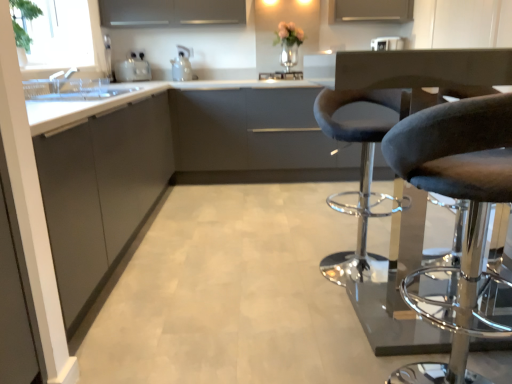
Measure the distance between point [91,285] and camera.

Point [91,285] is 6.15 feet from camera.

The height and width of the screenshot is (384, 512). I want to click on dark gray fabric stool at right, so click(x=391, y=230).

Measure the distance between satin silver toaster at left, placed as the third appliance when sorted from right to left, and camera.

They are 3.76 meters apart.

Where is `satin silver sink at center, the 2th appliance viewed from the left`? satin silver sink at center, the 2th appliance viewed from the left is located at coordinates (281, 75).

Is gray fabric swivel chair at right situated inside satin silver toaster at left, placed as the third appliance when sorted from right to left, or outside?

gray fabric swivel chair at right is located beyond the bounds of satin silver toaster at left, placed as the third appliance when sorted from right to left.

In the scene shown: Can you tell me how much gray fabric swivel chair at right and satin silver toaster at left, placed as the third appliance when sorted from right to left, differ in facing direction?

gray fabric swivel chair at right and satin silver toaster at left, placed as the third appliance when sorted from right to left, are facing 46.4 degrees away from each other.

From the image's perspective, is gray fabric swivel chair at right beneath satin silver toaster at left, placed as the third appliance when sorted from right to left?

Indeed, from the image's perspective, gray fabric swivel chair at right is shown beneath satin silver toaster at left, placed as the third appliance when sorted from right to left.

Which is more to the right, gray fabric swivel chair at right or satin silver toaster at left, placed as the third appliance when sorted from right to left?

gray fabric swivel chair at right is more to the right.

Could you tell me if matte gray cabinet at upper center, marked as the 3th cabinetry in a front-to-back arrangement, is facing matte gray cabinet at center, arranged as the 2th cabinetry when viewed from the front?

No, matte gray cabinet at upper center, marked as the 3th cabinetry in a front-to-back arrangement, is not turned towards matte gray cabinet at center, arranged as the 2th cabinetry when viewed from the front.

From a real-world perspective, is matte gray cabinet at upper center, marked as the 3th cabinetry in a front-to-back arrangement, positioned above or below matte gray cabinet at center, arranged as the 2th cabinetry when viewed from the front?

matte gray cabinet at upper center, marked as the 3th cabinetry in a front-to-back arrangement, is above matte gray cabinet at center, arranged as the 2th cabinetry when viewed from the front.

Can you confirm if matte gray cabinet at upper center, the first cabinetry positioned from the back, is thinner than matte gray cabinet at center, arranged as the 2th cabinetry when viewed from the front?

Correct, the width of matte gray cabinet at upper center, the first cabinetry positioned from the back, is less than that of matte gray cabinet at center, arranged as the 2th cabinetry when viewed from the front.

Can you confirm if matte gray cabinet at upper center, marked as the 3th cabinetry in a front-to-back arrangement, is taller than matte gray cabinet at center, arranged as the 2th cabinetry when viewed from the front?

No, matte gray cabinet at upper center, marked as the 3th cabinetry in a front-to-back arrangement, is not taller than matte gray cabinet at center, arranged as the 2th cabinetry when viewed from the front.

Considering the sizes of objects dark gray fabric stool at right and gray fabric swivel chair at right in the image provided, who is smaller, dark gray fabric stool at right or gray fabric swivel chair at right?

Smaller between the two is gray fabric swivel chair at right.

Are dark gray fabric stool at right and gray fabric swivel chair at right far apart?

They are positioned close to each other.

Considering the positions of objects dark gray fabric stool at right and gray fabric swivel chair at right in the image provided, who is behind, dark gray fabric stool at right or gray fabric swivel chair at right?

gray fabric swivel chair at right is more distant.

From a real-world perspective, is dark gray fabric stool at right located higher than gray fabric swivel chair at right?

Yes, from a real-world perspective, dark gray fabric stool at right is over gray fabric swivel chair at right

Could you tell me if dark gray fabric stool at right is turned towards matte gray cabinet at left, acting as the 3th cabinetry starting from the back?

No, dark gray fabric stool at right is not facing towards matte gray cabinet at left, acting as the 3th cabinetry starting from the back.

Between dark gray fabric stool at right and matte gray cabinet at left, which is the first cabinetry from front to back, which one has smaller width?

dark gray fabric stool at right is thinner.

Would you say dark gray fabric stool at right is to the left or to the right of matte gray cabinet at left, which is the first cabinetry from front to back, in the picture?

dark gray fabric stool at right is positioned on matte gray cabinet at left, which is the first cabinetry from front to back,'s right side.

From the image's perspective, is dark gray fabric stool at right below matte gray cabinet at left, which is the first cabinetry from front to back?

Yes, from the image's perspective, dark gray fabric stool at right is below matte gray cabinet at left, which is the first cabinetry from front to back.

Can you confirm if matte gray cabinet at center, arranged as the 2th cabinetry when viewed from the front, is positioned to the left of dark gray fabric stool at right?

Yes, matte gray cabinet at center, arranged as the 2th cabinetry when viewed from the front, is to the left of dark gray fabric stool at right.

Between point (233, 145) and point (414, 315), which one is positioned in front?

Point (414, 315)

Is white glossy toaster at upper center, marked as the third appliance in a left-to-right arrangement, inside or outside of matte gray cabinet at center, the 2th cabinetry positioned from the back?

white glossy toaster at upper center, marked as the third appliance in a left-to-right arrangement, is not enclosed by matte gray cabinet at center, the 2th cabinetry positioned from the back.

Considering the relative sizes of white glossy toaster at upper center, marked as the third appliance in a left-to-right arrangement, and matte gray cabinet at center, the 2th cabinetry positioned from the back, in the image provided, is white glossy toaster at upper center, marked as the third appliance in a left-to-right arrangement, wider than matte gray cabinet at center, the 2th cabinetry positioned from the back,?

In fact, white glossy toaster at upper center, marked as the third appliance in a left-to-right arrangement, might be narrower than matte gray cabinet at center, the 2th cabinetry positioned from the back.

From a real-world perspective, is white glossy toaster at upper center, the 1th appliance viewed from the right, on matte gray cabinet at center, the 2th cabinetry positioned from the back?

Yes, from a real-world perspective, white glossy toaster at upper center, the 1th appliance viewed from the right, is on top of matte gray cabinet at center, the 2th cabinetry positioned from the back.

The height and width of the screenshot is (384, 512). In order to click on chair below the white glossy toaster at upper center, the 1th appliance viewed from the right (from the image's perspective) in this screenshot , I will do `click(391, 230)`.

Which object is thinner, white glossy toaster at upper center, the 1th appliance viewed from the right, or dark gray fabric stool at right?

white glossy toaster at upper center, the 1th appliance viewed from the right.

Is white glossy toaster at upper center, marked as the third appliance in a left-to-right arrangement, closer to the viewer compared to dark gray fabric stool at right?

No, the depth of white glossy toaster at upper center, marked as the third appliance in a left-to-right arrangement, is greater than that of dark gray fabric stool at right.

In terms of height, does white glossy toaster at upper center, the 1th appliance viewed from the right, look taller or shorter compared to dark gray fabric stool at right?

white glossy toaster at upper center, the 1th appliance viewed from the right, is shorter than dark gray fabric stool at right.

Where is `swivel chair below the satin silver toaster at left, placed as the third appliance when sorted from right to left (from the image's perspective)`? This screenshot has width=512, height=384. swivel chair below the satin silver toaster at left, placed as the third appliance when sorted from right to left (from the image's perspective) is located at coordinates (360, 180).

Where is `cabinetry that is the 1st one when counting forward from the matte gray cabinet at upper center, marked as the 3th cabinetry in a front-to-back arrangement`? This screenshot has height=384, width=512. cabinetry that is the 1st one when counting forward from the matte gray cabinet at upper center, marked as the 3th cabinetry in a front-to-back arrangement is located at coordinates click(x=254, y=138).

Considering their positions, is matte gray cabinet at left, which is the first cabinetry from front to back, positioned closer to white glossy toaster at upper center, the 1th appliance viewed from the right, than satin silver sink at center, the 2th appliance viewed from the left?

Among the two, satin silver sink at center, the 2th appliance viewed from the left, is located nearer to white glossy toaster at upper center, the 1th appliance viewed from the right.

When comparing their distances from dark gray fabric stool at right, does matte gray cabinet at center, arranged as the 2th cabinetry when viewed from the front, or matte gray cabinet at left, which is the first cabinetry from front to back, seem further?

matte gray cabinet at left, which is the first cabinetry from front to back, is further to dark gray fabric stool at right.

Which object lies nearer to the anchor point matte gray cabinet at left, which is the first cabinetry from front to back, matte gray cabinet at center, the 2th cabinetry positioned from the back, or dark gray fabric stool at right?

Based on the image, dark gray fabric stool at right appears to be nearer to matte gray cabinet at left, which is the first cabinetry from front to back.

Looking at the image, which one is located further to matte gray cabinet at center, arranged as the 2th cabinetry when viewed from the front, satin silver sink at center, the 2th appliance viewed from the left, or matte gray cabinet at left, acting as the 3th cabinetry starting from the back?

matte gray cabinet at left, acting as the 3th cabinetry starting from the back, is further to matte gray cabinet at center, arranged as the 2th cabinetry when viewed from the front.

When comparing their distances from matte gray cabinet at center, arranged as the 2th cabinetry when viewed from the front, does matte gray cabinet at left, acting as the 3th cabinetry starting from the back, or gray fabric swivel chair at right seem closer?

Among the two, gray fabric swivel chair at right is located nearer to matte gray cabinet at center, arranged as the 2th cabinetry when viewed from the front.

When comparing their distances from satin silver toaster at left, placed as the third appliance when sorted from right to left, does dark gray fabric stool at right or matte gray cabinet at upper center, the first cabinetry positioned from the back, seem further?

The object further to satin silver toaster at left, placed as the third appliance when sorted from right to left, is dark gray fabric stool at right.

Based on the photo, which object lies nearer to the anchor point matte gray cabinet at upper center, marked as the 3th cabinetry in a front-to-back arrangement, matte gray cabinet at center, the 2th cabinetry positioned from the back, or satin silver toaster at left, which ranks as the first appliance in left-to-right order?

Based on the image, satin silver toaster at left, which ranks as the first appliance in left-to-right order, appears to be nearer to matte gray cabinet at upper center, marked as the 3th cabinetry in a front-to-back arrangement.

From the picture: From the image, which object appears to be nearer to gray fabric swivel chair at right, white glossy toaster at upper center, the 1th appliance viewed from the right, or matte gray cabinet at left, acting as the 3th cabinetry starting from the back?

Among the two, matte gray cabinet at left, acting as the 3th cabinetry starting from the back, is located nearer to gray fabric swivel chair at right.

The image size is (512, 384). What are the coordinates of `swivel chair between dark gray fabric stool at right and white glossy toaster at upper center, the 1th appliance viewed from the right, in the front-back direction` in the screenshot? It's located at [360, 180].

This screenshot has height=384, width=512. What are the coordinates of `cabinetry between matte gray cabinet at upper center, marked as the 3th cabinetry in a front-to-back arrangement, and white glossy toaster at upper center, marked as the third appliance in a left-to-right arrangement, from left to right` in the screenshot? It's located at (254, 138).

You are a GUI agent. You are given a task and a screenshot of the screen. Output one action in this format:
    pyautogui.click(x=<x>, y=<y>)
    Task: Click on the appliance between matte gray cabinet at upper center, marked as the 3th cabinetry in a front-to-back arrangement, and white glossy toaster at upper center, the 1th appliance viewed from the right, in the horizontal direction
    Image resolution: width=512 pixels, height=384 pixels.
    Given the screenshot: What is the action you would take?
    pyautogui.click(x=281, y=75)

Locate an element on the screen. appliance between satin silver toaster at left, placed as the third appliance when sorted from right to left, and white glossy toaster at upper center, the 1th appliance viewed from the right, from left to right is located at coordinates (281, 75).